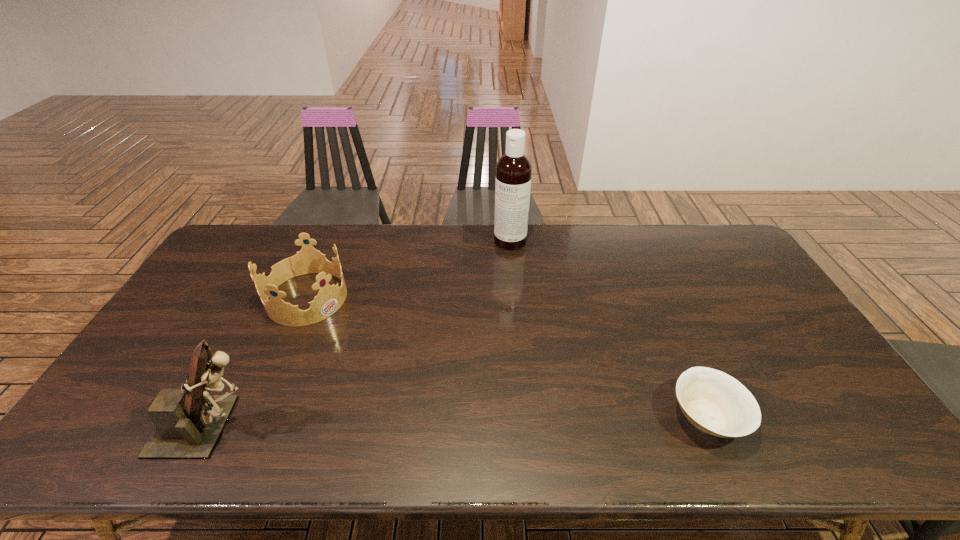
In the image, there is a desktop. Find the location of `vacant space at the near edge`. vacant space at the near edge is located at coordinates (661, 390).

Find the location of `free space at the left edge of the desktop`. free space at the left edge of the desktop is located at coordinates (232, 275).

At what (x,y) coordinates should I click in order to perform the action: click on free space at the right edge of the desktop. Please return your answer as a coordinate pair (x, y). Image resolution: width=960 pixels, height=540 pixels. Looking at the image, I should click on (763, 293).

This screenshot has width=960, height=540. Identify the location of free space at the far right corner. (709, 245).

The height and width of the screenshot is (540, 960). I want to click on vacant space in between the tiara and the figurine, so click(x=260, y=362).

Locate an element on the screen. The width and height of the screenshot is (960, 540). free spot between the second shortest object and the second tallest object is located at coordinates (260, 362).

The width and height of the screenshot is (960, 540). I want to click on free area in between the farthest object and the bowl, so click(609, 329).

This screenshot has height=540, width=960. I want to click on empty space between the shortest object and the third tallest object, so click(507, 357).

Where is `empty location between the third nearest object and the third object from left to right`? empty location between the third nearest object and the third object from left to right is located at coordinates (409, 269).

This screenshot has height=540, width=960. In order to click on vacant point located between the farthest object and the third shortest object in this screenshot , I will do `click(361, 334)`.